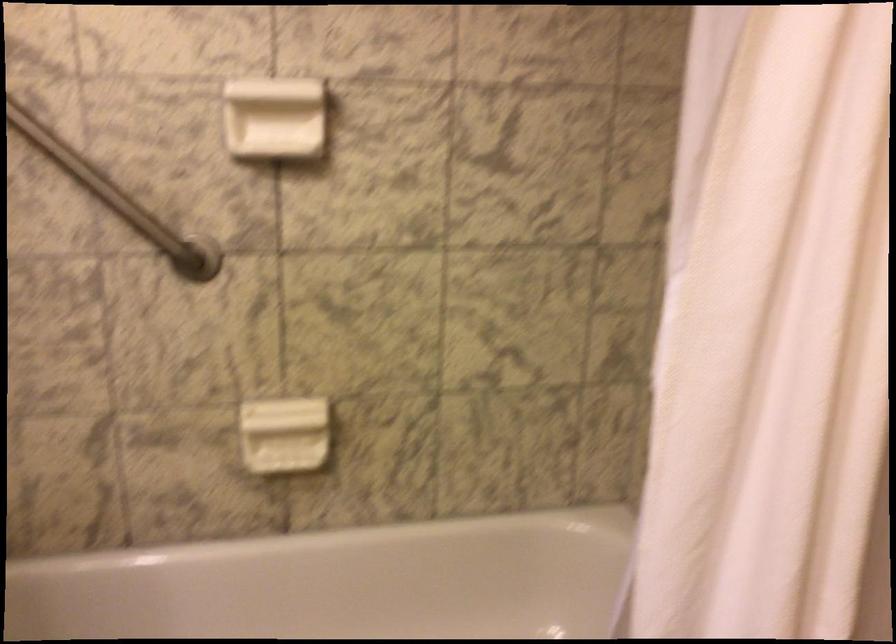
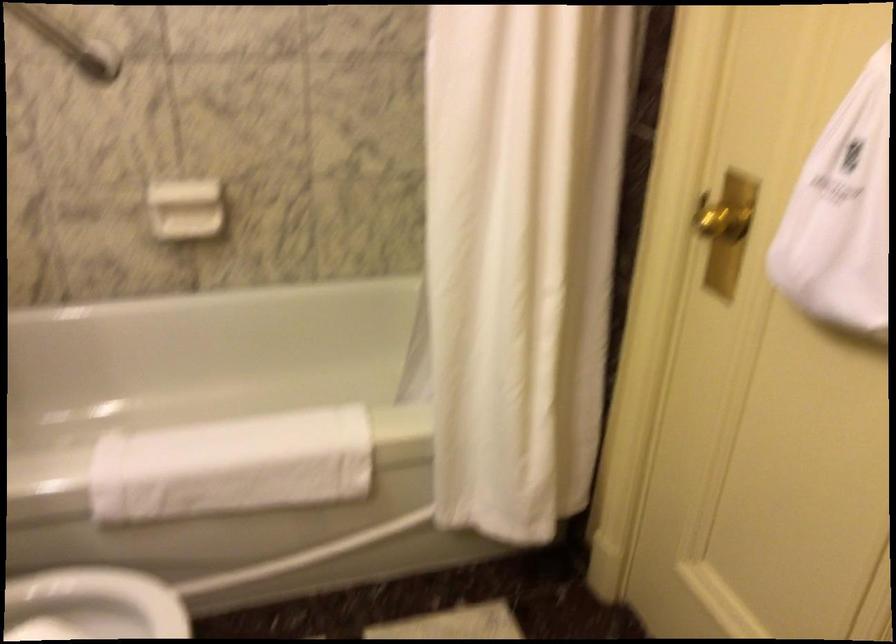
Locate, in the second image, the point that corresponds to point 174,245 in the first image.

(69, 42)